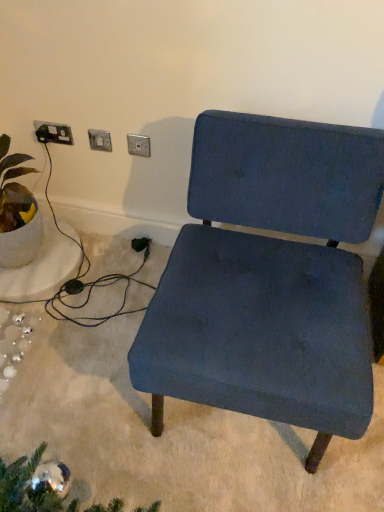
This screenshot has height=512, width=384. In order to click on vacant space to the right of green leafy plant in white pot at left in this screenshot , I will do `click(87, 277)`.